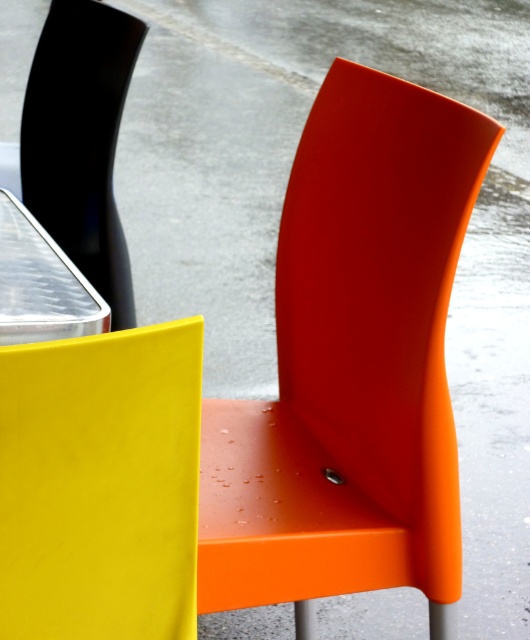
Question: Estimate the real-world distances between objects in this image. Which object is farther from the matte yellow chair at left?

Choices:
 (A) orange matte chair at center
 (B) matte black chair at left

Answer: (B)

Question: Which of these objects is positioned farthest from the matte yellow chair at left?

Choices:
 (A) orange matte chair at center
 (B) matte black chair at left

Answer: (B)

Question: Is orange matte chair at center behind matte yellow chair at left?

Choices:
 (A) no
 (B) yes

Answer: (B)

Question: Is orange matte chair at center bigger than matte black chair at left?

Choices:
 (A) no
 (B) yes

Answer: (B)

Question: Which point is closer to the camera?

Choices:
 (A) (86, 477)
 (B) (384, 248)
 (C) (56, 17)

Answer: (A)

Question: Is matte yellow chair at left positioned behind matte black chair at left?

Choices:
 (A) yes
 (B) no

Answer: (B)